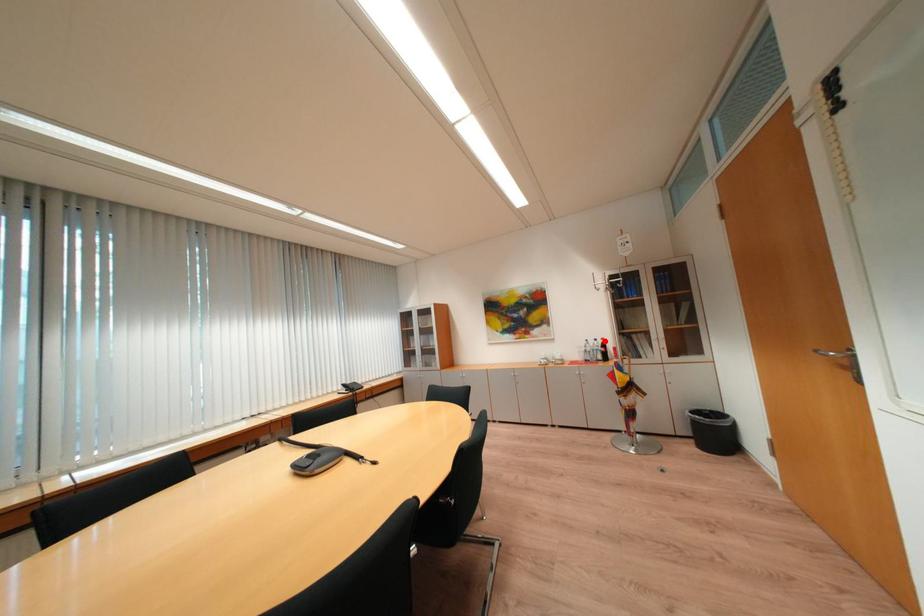
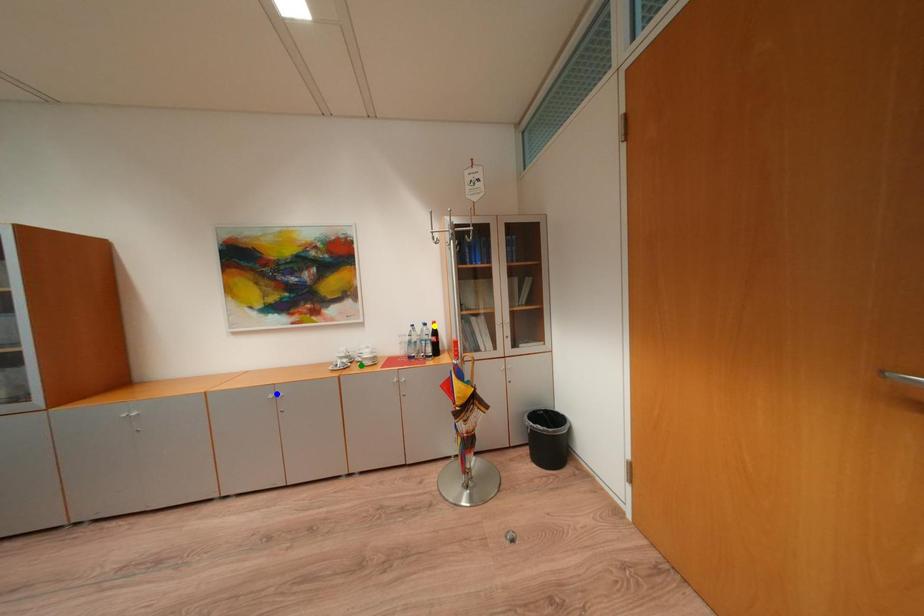
Question: I am providing you with two images of the same scene from different viewpoints. A red point is marked on the first image. You are given multiple points on the second image. Which point in image 2 represents the same 3d spot as the red point in image 1?

Choices:
 (A) yellow point
 (B) green point
 (C) blue point

Answer: (A)